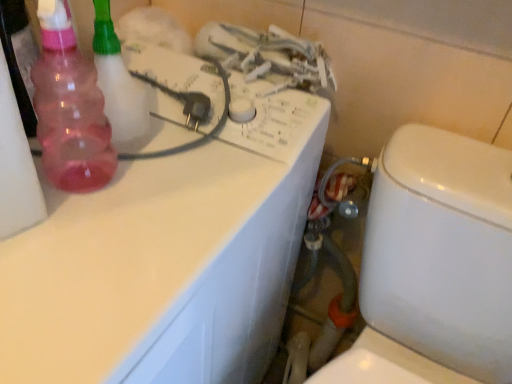
Question: Is pink translucent bottle at left spatially inside rubber hose at lower center, or outside of it?

Choices:
 (A) inside
 (B) outside

Answer: (B)

Question: Considering the positions of pink translucent bottle at left and rubber hose at lower center in the image, is pink translucent bottle at left bigger or smaller than rubber hose at lower center?

Choices:
 (A) big
 (B) small

Answer: (B)

Question: Estimate the real-world distances between objects in this image. Which object is closer to the pink translucent bottle at left?

Choices:
 (A) white glossy counter top at upper left
 (B) white glossy toilet at lower right
 (C) rubber hose at lower center
 (D) pink translucent spray bottle at left

Answer: (D)

Question: Based on their relative distances, which object is farther from the pink translucent spray bottle at left?

Choices:
 (A) rubber hose at lower center
 (B) pink translucent bottle at left
 (C) white glossy toilet at lower right
 (D) white glossy counter top at upper left

Answer: (A)